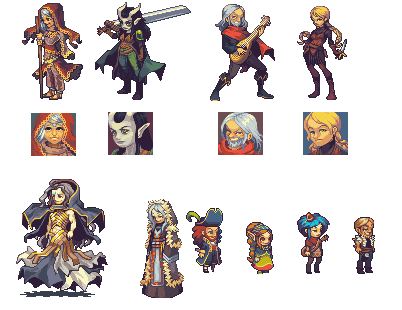
Identify the location of 4 boxes with anime character faces. (55, 129), (125, 134), (251, 131), (325, 129).